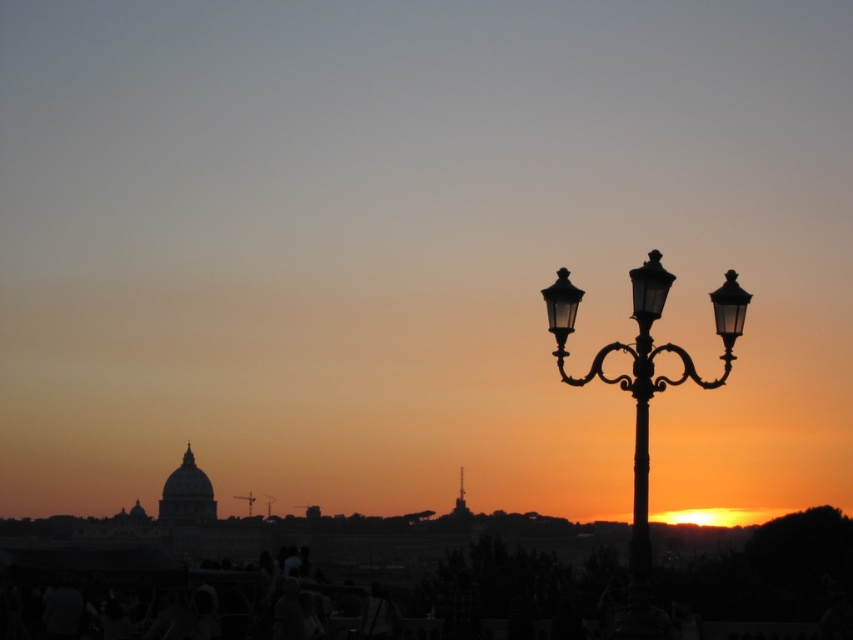
Question: Which point is closer to the camera?

Choices:
 (A) black metal pole at right
 (B) black metal lamp post at right

Answer: (B)

Question: Can you confirm if black metal lamp post at right is positioned to the left of black metal pole at right?

Choices:
 (A) yes
 (B) no

Answer: (A)

Question: Which object appears closest to the camera in this image?

Choices:
 (A) black metal pole at right
 (B) black metal lamp post at right

Answer: (B)

Question: Is black metal lamp post at right wider than black metal pole at right?

Choices:
 (A) yes
 (B) no

Answer: (A)

Question: Which of the following is the closest to the observer?

Choices:
 (A) black metal pole at right
 (B) black metal lamp post at right

Answer: (B)

Question: Observing the image, what is the correct spatial positioning of black metal lamp post at right in reference to black metal pole at right?

Choices:
 (A) above
 (B) below

Answer: (A)